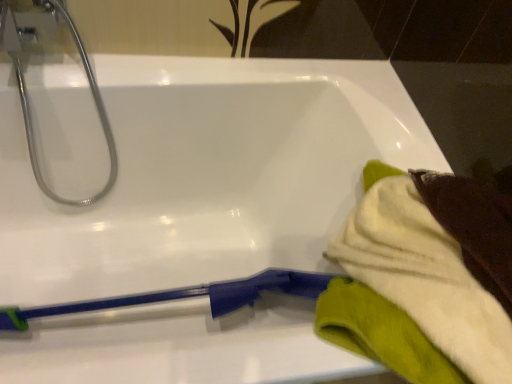
What is the approximate width of silver metallic tap at upper left?

It is 8.33 inches.

What do you see at coordinates (97, 110) in the screenshot? I see `silver metallic tap at upper left` at bounding box center [97, 110].

The image size is (512, 384). What are the coordinates of `silver metallic tap at upper left` in the screenshot? It's located at (97, 110).

Locate an element on the screen. The width and height of the screenshot is (512, 384). white soft towel at right is located at coordinates 381,333.

Image resolution: width=512 pixels, height=384 pixels. What do you see at coordinates (381, 333) in the screenshot?
I see `white soft towel at right` at bounding box center [381, 333].

Measure the distance between white soft towel at right and camera.

A distance of 22.52 inches exists between white soft towel at right and camera.

Locate an element on the screen. This screenshot has height=384, width=512. silver metallic tap at upper left is located at coordinates (97, 110).

Between white soft towel at right and silver metallic tap at upper left, which one appears on the left side from the viewer's perspective?

Positioned to the left is silver metallic tap at upper left.

Does white soft towel at right come in front of silver metallic tap at upper left?

Yes, white soft towel at right is closer to the viewer.

Which is more distant, (x=352, y=260) or (x=92, y=84)?

Point (x=92, y=84)

From the image's perspective, which is below, white soft towel at right or silver metallic tap at upper left?

white soft towel at right appears lower in the image.

From a real-world perspective, is white soft towel at right positioned under silver metallic tap at upper left based on gravity?

No, from a real-world perspective, white soft towel at right is not below silver metallic tap at upper left.

Can you confirm if white soft towel at right is thinner than silver metallic tap at upper left?

No.

Which of these two, white soft towel at right or silver metallic tap at upper left, stands taller?

With more height is silver metallic tap at upper left.

Who is bigger, white soft towel at right or silver metallic tap at upper left?

With larger size is silver metallic tap at upper left.

Is silver metallic tap at upper left surrounded by white soft towel at right?

No, white soft towel at right does not contain silver metallic tap at upper left.

Is white soft towel at right directly adjacent to silver metallic tap at upper left?

No.

Is white soft towel at right positioned with its back to silver metallic tap at upper left?

That's not correct — white soft towel at right is not looking away from silver metallic tap at upper left.

Can you tell me how much white soft towel at right and silver metallic tap at upper left differ in facing direction?

There is a 24.3-degree angle between the facing directions of white soft towel at right and silver metallic tap at upper left.

Image resolution: width=512 pixels, height=384 pixels. In order to click on bath towel below the silver metallic tap at upper left (from the image's perspective) in this screenshot , I will do `click(381, 333)`.

Which is more to the left, silver metallic tap at upper left or white soft towel at right?

silver metallic tap at upper left.

Considering their positions, is silver metallic tap at upper left located in front of or behind white soft towel at right?

silver metallic tap at upper left is behind white soft towel at right.

Which is closer to the camera, (x=32, y=132) or (x=459, y=206)?

The point (x=459, y=206) is in front.

From the image's perspective, relative to white soft towel at right, is silver metallic tap at upper left above or below?

A: Clearly, from the image's perspective, silver metallic tap at upper left is above white soft towel at right.

From a real-world perspective, does silver metallic tap at upper left sit lower than white soft towel at right?

Yes, from a real-world perspective, silver metallic tap at upper left is under white soft towel at right.

Based on the photo, is silver metallic tap at upper left thinner than white soft towel at right?

Yes.

Considering the relative sizes of silver metallic tap at upper left and white soft towel at right in the image provided, is silver metallic tap at upper left taller than white soft towel at right?

Yes, silver metallic tap at upper left is taller than white soft towel at right.

Considering the relative sizes of silver metallic tap at upper left and white soft towel at right in the image provided, is silver metallic tap at upper left bigger than white soft towel at right?

Yes.

Is silver metallic tap at upper left not within white soft towel at right?

silver metallic tap at upper left lies outside white soft towel at right's area.

Is silver metallic tap at upper left with white soft towel at right?

silver metallic tap at upper left and white soft towel at right are clearly separated.

Is silver metallic tap at upper left aimed at white soft towel at right?

No, silver metallic tap at upper left is not oriented towards white soft towel at right.

Find the location of a particular element. The width and height of the screenshot is (512, 384). bath towel above the silver metallic tap at upper left (from a real-world perspective) is located at coordinates (381, 333).

Identify the location of tap below the white soft towel at right (from a real-world perspective). (97, 110).

Where is `bath towel on the right of silver metallic tap at upper left`? This screenshot has width=512, height=384. bath towel on the right of silver metallic tap at upper left is located at coordinates (381, 333).